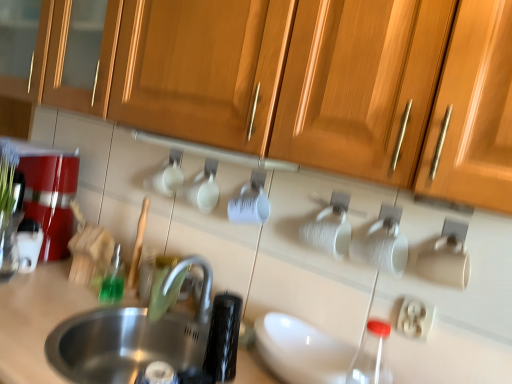
Question: Considering the positions of stainless steel sink at lower left and metallic red coffee machine at left in the image, is stainless steel sink at lower left wider or thinner than metallic red coffee machine at left?

Choices:
 (A) thin
 (B) wide

Answer: (B)

Question: Is stainless steel sink at lower left taller or shorter than metallic red coffee machine at left?

Choices:
 (A) short
 (B) tall

Answer: (A)

Question: Based on their relative distances, which object is farther from the wooden cabinet at upper center?

Choices:
 (A) stainless steel sink at lower left
 (B) green translucent bottle at left
 (C) white glossy coffee maker at left
 (D) metallic red coffee machine at left
 (E) white plastic electric outlet at lower right

Answer: (C)

Question: Which object is positioned closest to the white glossy coffee maker at left?

Choices:
 (A) stainless steel sink at lower left
 (B) wooden cabinet at upper center
 (C) white plastic electric outlet at lower right
 (D) green translucent bottle at left
 (E) metallic red coffee machine at left

Answer: (E)